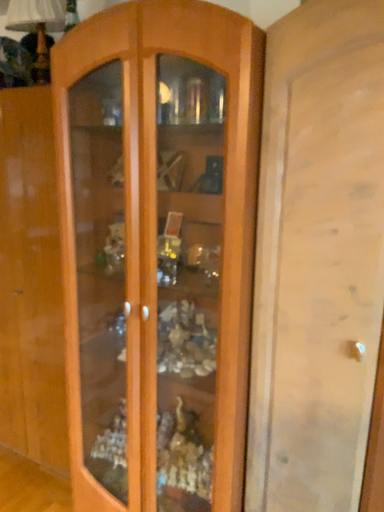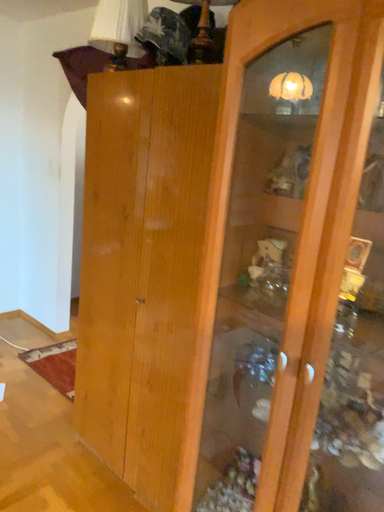
Question: Which way did the camera rotate in the video?

Choices:
 (A) rotated right
 (B) rotated left

Answer: (B)